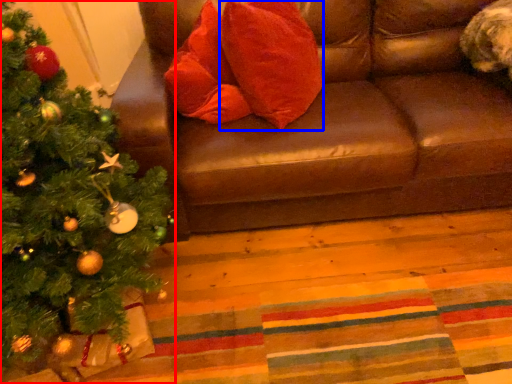
Question: Which object is further to the camera taking this photo, christmas tree (highlighted by a red box) or throw pillow (highlighted by a blue box)?

Choices:
 (A) christmas tree
 (B) throw pillow

Answer: (B)